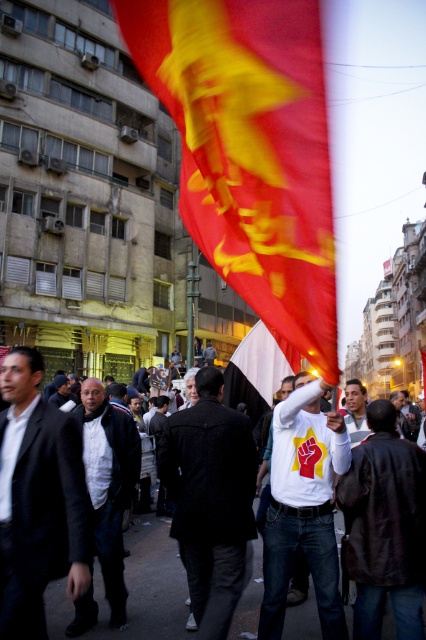
You are a photographer trying to capture the protest scene. You notice two individuals wearing a black textured coat at center and a dark brown leather jacket at center. Which one is positioned to the left of the other?

The black textured coat at center is to the left of the dark brown leather jacket at center.